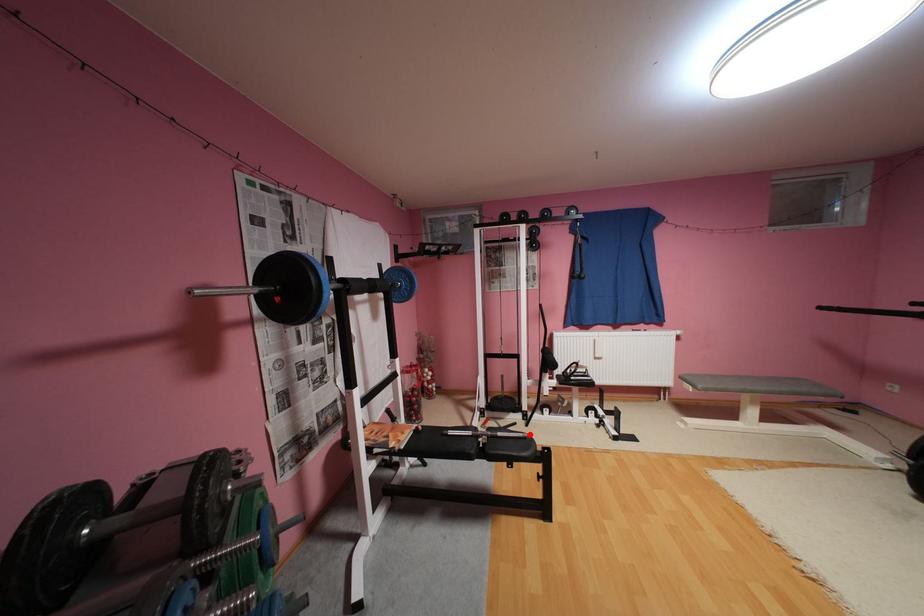
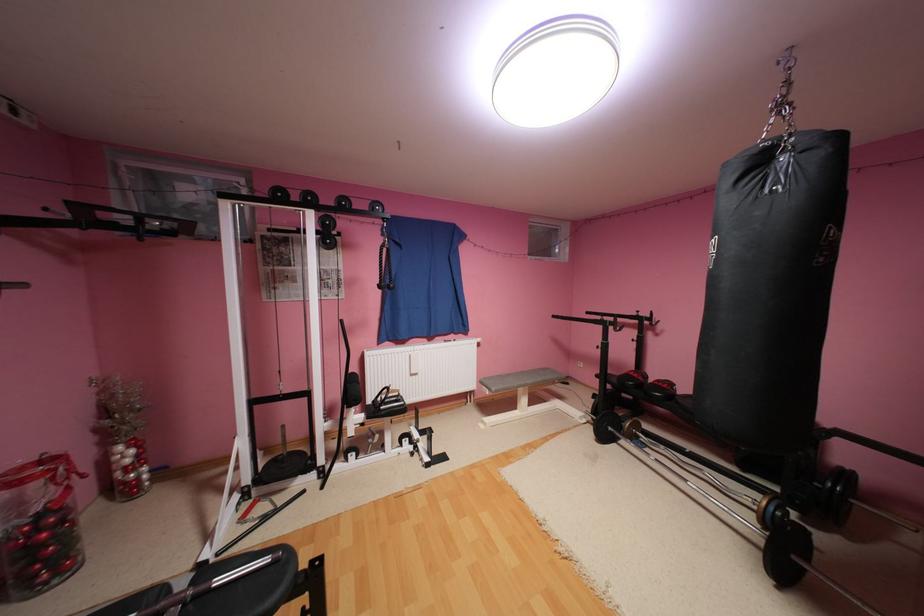
Question: I am providing you with two images of the same scene from different viewpoints. Image1 has a red point marked. In image2, the corresponding 3D location appears at what relative position? Reply with the corresponding letter.

Choices:
 (A) Closer
 (B) Farther

Answer: (B)